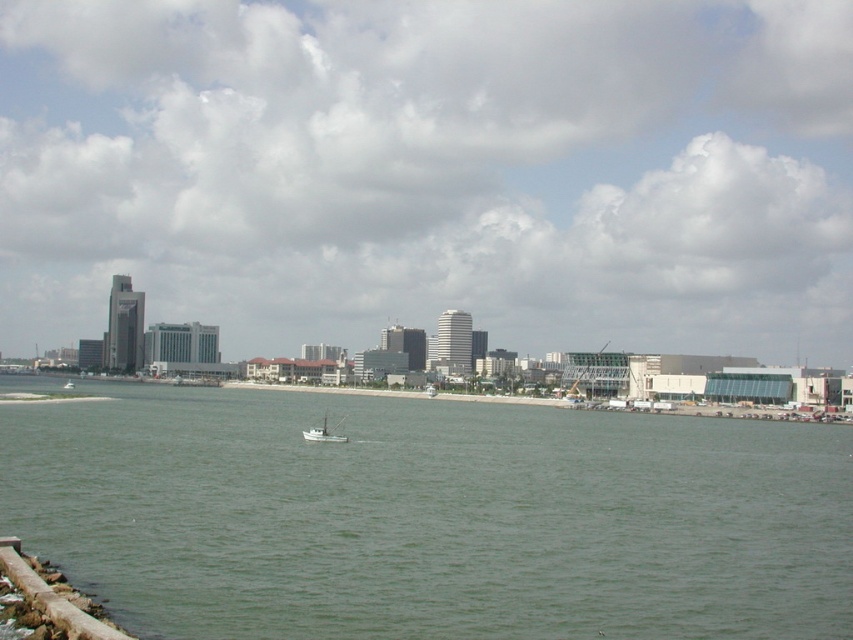
Who is shorter, transparent glass skyscrapers at center or green water at lower left?

green water at lower left

Who is more distant from viewer, [635,323] or [407,496]?

The point [635,323] is more distant.

The height and width of the screenshot is (640, 853). Find the location of `transparent glass skyscrapers at center`. transparent glass skyscrapers at center is located at coordinates (432, 172).

Does green water at lower left appear over white matte boat at center?

Actually, green water at lower left is below white matte boat at center.

Is point (265, 452) farther from viewer compared to point (323, 436)?

No.

Which is in front, point (567, 465) or point (337, 440)?

Positioned in front is point (567, 465).

Identify the location of green water at lower left. 430,516.

Which is below, transparent glass skyscrapers at center or white matte boat at center?

white matte boat at center

Who is taller, transparent glass skyscrapers at center or white matte boat at center?

Standing taller between the two is transparent glass skyscrapers at center.

Is point (624, 42) closer to camera compared to point (318, 435)?

That is False.

In order to click on transparent glass skyscrapers at center in this screenshot , I will do `click(432, 172)`.